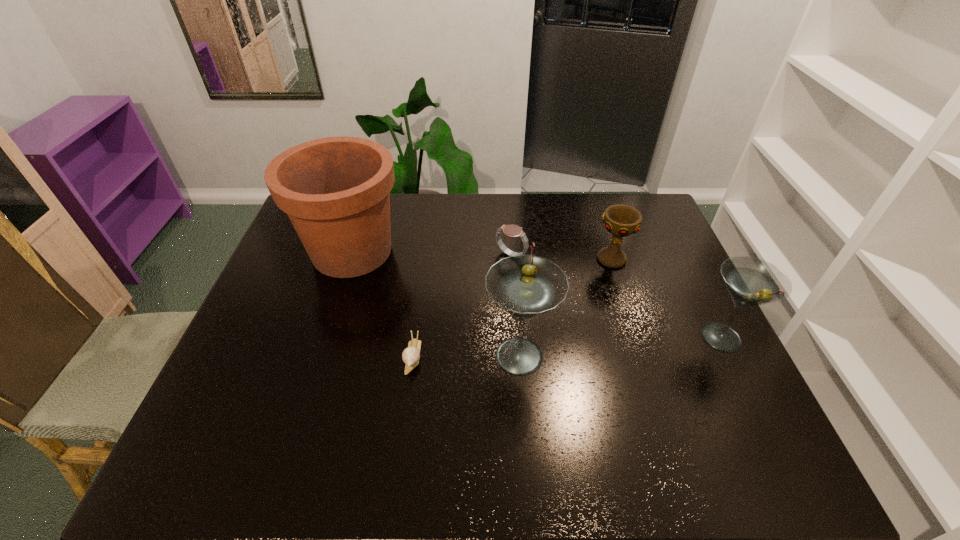
Considering the uniform spacing of martinis, where should an additional martini be positioned on the left? Please locate a free spot. Please provide its 2D coordinates. Your answer should be formatted as a tuple, i.e. [(x, y)], where the tuple contains the x and y coordinates of a point satisfying the conditions above.

[(302, 374)]